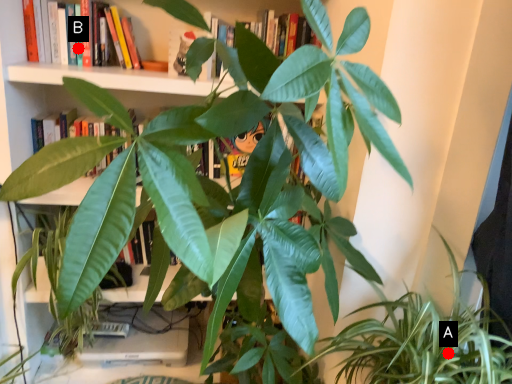
Question: Two points are circled on the image, labeled by A and B beside each circle. Among these points, which one is nearest to the camera?

Choices:
 (A) A is closer
 (B) B is closer

Answer: (A)